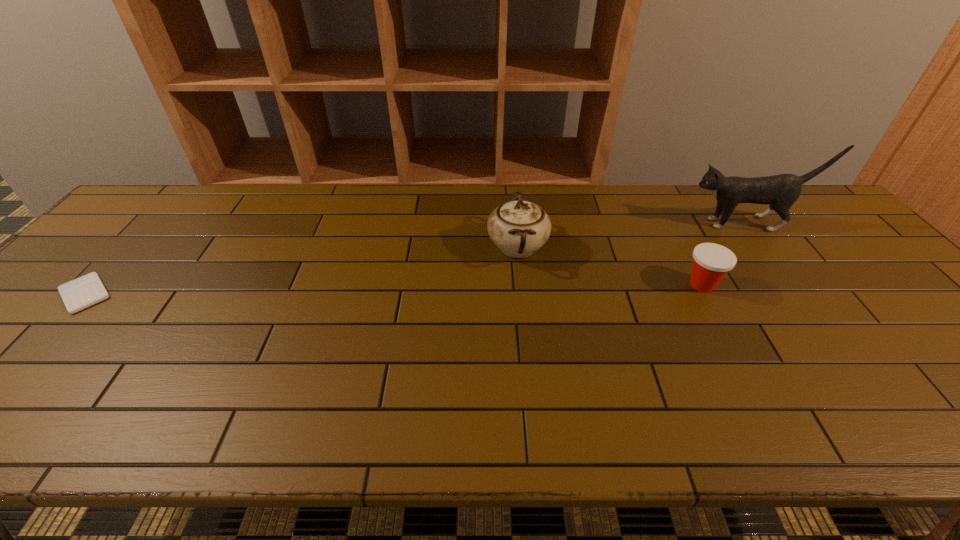
This screenshot has width=960, height=540. I want to click on vacant space at the right edge of the desktop, so click(x=953, y=388).

Where is `free space at the far left corner`? This screenshot has height=540, width=960. free space at the far left corner is located at coordinates (158, 226).

Locate an element on the screen. The width and height of the screenshot is (960, 540). free space between the third object from right to left and the calculator is located at coordinates (301, 271).

Locate an element on the screen. empty space that is in between the Dixie cup and the leftmost object is located at coordinates (394, 289).

This screenshot has height=540, width=960. Identify the location of free space between the second tallest object and the calculator. (301, 271).

Find the location of a particular element. free area in between the cat and the leftmost object is located at coordinates (416, 259).

Where is `free space between the second shortest object and the leftmost object`? The height and width of the screenshot is (540, 960). free space between the second shortest object and the leftmost object is located at coordinates (394, 289).

Locate an element on the screen. This screenshot has width=960, height=540. vacant area between the cat and the leftmost object is located at coordinates (416, 259).

The height and width of the screenshot is (540, 960). What are the coordinates of `vacant area that lies between the third shortest object and the calculator` in the screenshot? It's located at (301, 271).

Where is `vacant area that lies between the chinaware and the shortest object`? vacant area that lies between the chinaware and the shortest object is located at coordinates (301, 271).